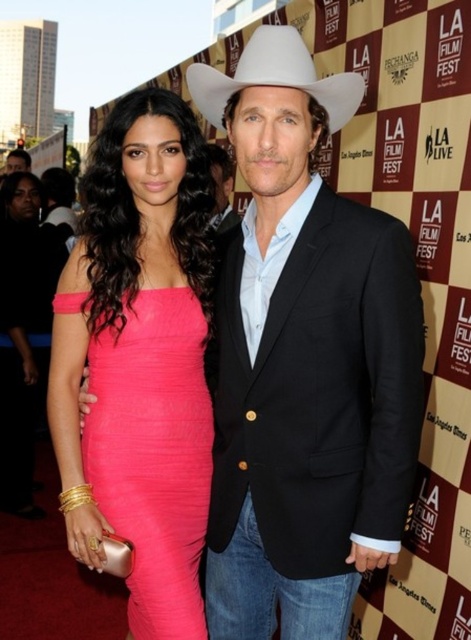
You are a photographer at the LA Film Fest backdrop. You see the pink ribbed dress at center and the white matte fedora at upper center. Which object is taller?

The pink ribbed dress at center is taller than the white matte fedora at upper center.

You are a photographer at the LA Film Fest backdrop. You need to place a pink satin clutch at lower left and a pink ribbed dress at center in your frame. According to the scene, which object is more to the right?

The pink ribbed dress at center is positioned on the right side of the pink satin clutch at lower left, so the pink ribbed dress at center is more to the right.

You are a photographer at the LA Film Fest event. You need to capture a closeup shot of the pink ribbed dress at center and the white matte fedora at upper center. Since the camera can only focus on one object at a time, which object should you focus on first to ensure it appears sharp in the photo?

The pink ribbed dress at center is positioned on the left side of white matte fedora at upper center. Since the camera focuses on the closest object first, you should focus on the pink ribbed dress at center first to ensure it appears sharp before the white matte fedora at upper center.